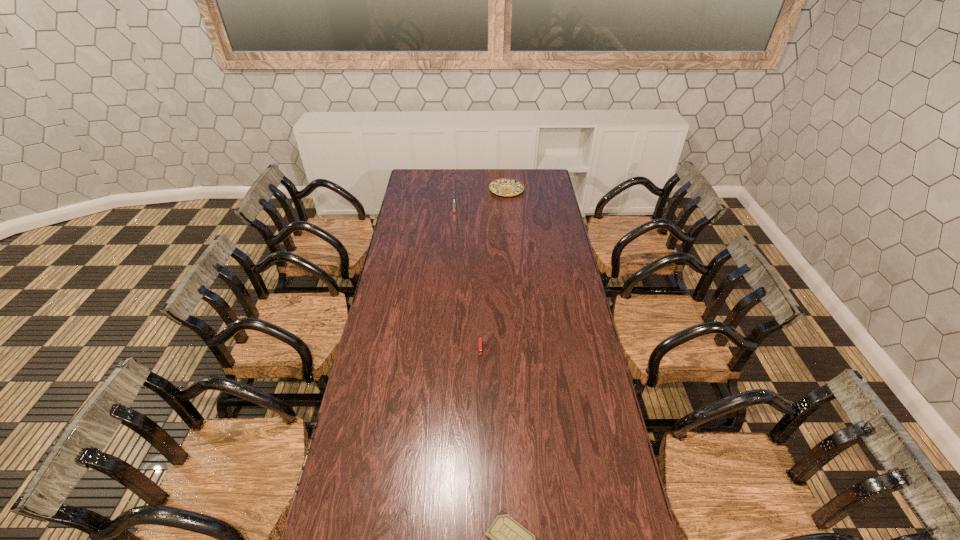
In the image, there is a desktop. Where is `vacant space at the far edge`? vacant space at the far edge is located at coordinates (454, 174).

Find the location of `vacant region at the left edge of the desktop`. vacant region at the left edge of the desktop is located at coordinates (412, 286).

Where is `free space at the right edge`? Image resolution: width=960 pixels, height=540 pixels. free space at the right edge is located at coordinates coord(560,291).

The width and height of the screenshot is (960, 540). In order to click on vacant space at the far left corner in this screenshot , I will do `click(420, 184)`.

Where is `free point between the third tallest object and the third object from right to left`? The width and height of the screenshot is (960, 540). free point between the third tallest object and the third object from right to left is located at coordinates (493, 269).

Identify the location of free space between the shorter stapler and the farthest object. (493, 269).

Locate which object is the closest to the second object from left to right. Please provide its 2D coordinates. Your answer should be formatted as a tuple, i.e. [(x, y)], where the tuple contains the x and y coordinates of a point satisfying the conditions above.

[(509, 539)]

Select which object appears as the second closest to the third shortest object. Please provide its 2D coordinates. Your answer should be formatted as a tuple, i.e. [(x, y)], where the tuple contains the x and y coordinates of a point satisfying the conditions above.

[(454, 200)]